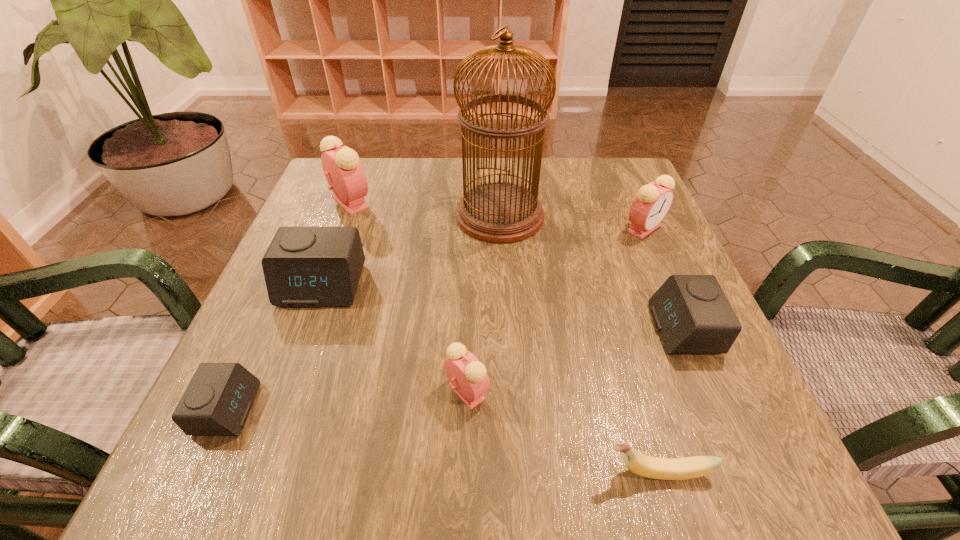
What are the coordinates of `free location at the far right corner of the desktop` in the screenshot? It's located at pos(607,209).

This screenshot has height=540, width=960. I want to click on blank space at the near right corner of the desktop, so click(x=784, y=482).

This screenshot has width=960, height=540. What are the coordinates of `empty location between the birdcage and the rightmost black alarm clock` in the screenshot? It's located at (591, 272).

The image size is (960, 540). I want to click on empty space that is in between the second biggest pink alarm clock and the birdcage, so click(x=572, y=222).

Locate an element on the screen. free spot between the tallest object and the sixth shortest object is located at coordinates (572, 222).

I want to click on unoccupied area between the tallest object and the second pink alarm clock from left to right, so click(x=484, y=303).

You are a GUI agent. You are given a task and a screenshot of the screen. Output one action in this format:
    pyautogui.click(x=<x>, y=<y>)
    Task: Click on the vacant space that is in between the nearest black alarm clock and the sixth shortest object
    
    Given the screenshot: What is the action you would take?
    pyautogui.click(x=436, y=319)

Locate an element on the screen. The width and height of the screenshot is (960, 540). free space between the biggest black alarm clock and the birdcage is located at coordinates (411, 251).

You are a GUI agent. You are given a task and a screenshot of the screen. Output one action in this format:
    pyautogui.click(x=<x>, y=<y>)
    Task: Click on the vacant space in between the second pink alarm clock from right to left and the nearest object
    The height and width of the screenshot is (540, 960).
    Given the screenshot: What is the action you would take?
    pyautogui.click(x=563, y=432)

Identify the location of free space between the banana and the biggest black alarm clock. Image resolution: width=960 pixels, height=540 pixels. (490, 379).